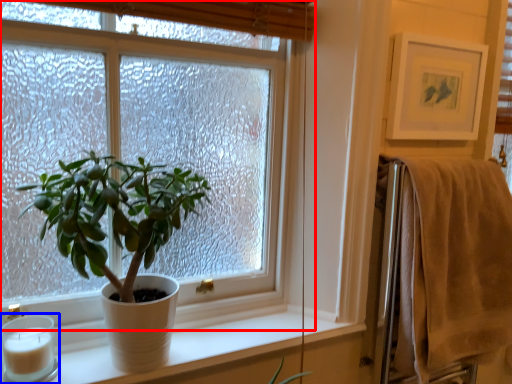
Question: Which object is further to the camera taking this photo, window (highlighted by a red box) or candle holder (highlighted by a blue box)?

Choices:
 (A) window
 (B) candle holder

Answer: (B)